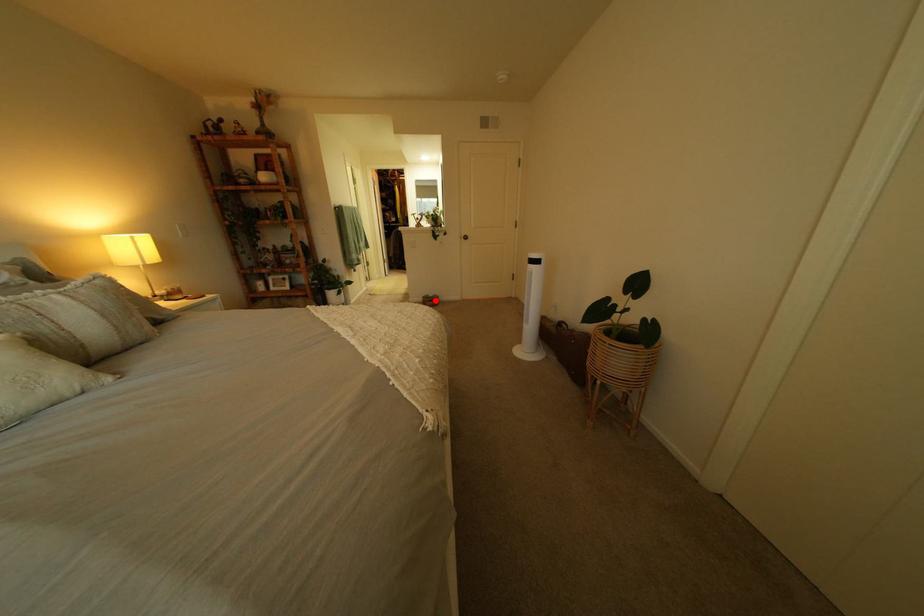
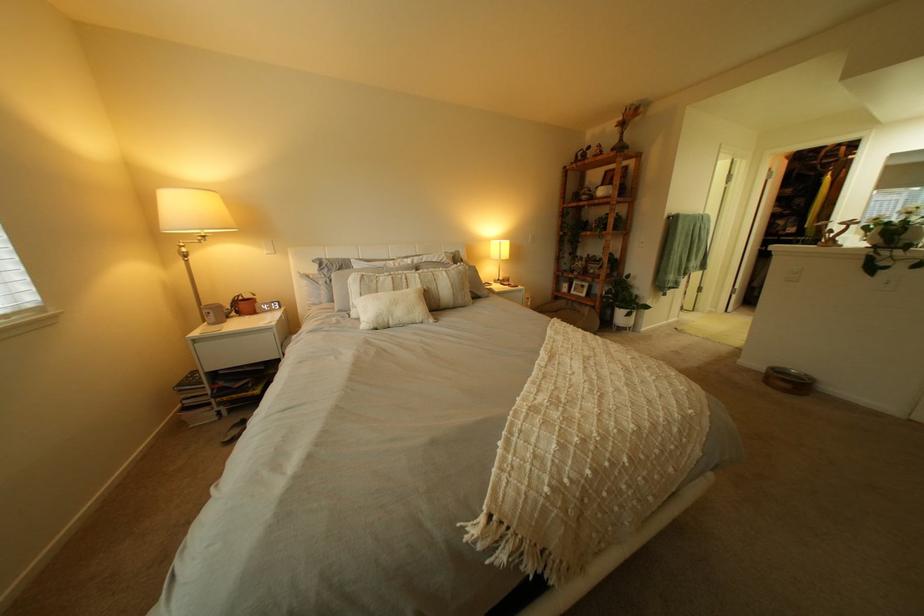
Question: I am providing you with two images of the same scene from different viewpoints. Image1 has a red point marked. In image2, the corresponding 3D location appears at what relative position? Reply with the corresponding letter.

Choices:
 (A) Closer
 (B) Farther

Answer: (B)